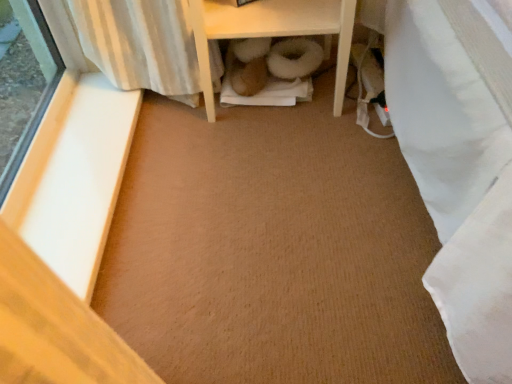
At what (x,y) coordinates should I click in order to perform the action: click on white wood shelf at center. Please return your answer as a coordinate pair (x, y). Looking at the image, I should click on [x=272, y=31].

Describe the element at coordinates (272, 31) in the screenshot. The width and height of the screenshot is (512, 384). I see `white wood shelf at center` at that location.

Measure the distance between point [24,178] and camera.

The depth of point [24,178] is 3.36 feet.

The width and height of the screenshot is (512, 384). What do you see at coordinates (74, 177) in the screenshot? I see `white smooth wood at left` at bounding box center [74, 177].

Measure the distance between white smooth wood at left and camera.

white smooth wood at left and camera are 32.50 inches apart.

The width and height of the screenshot is (512, 384). Find the location of `white smooth wood at left`. white smooth wood at left is located at coordinates 74,177.

Where is `white wood shelf at center`? white wood shelf at center is located at coordinates (272, 31).

Considering the relative positions of white wood shelf at center and white smooth wood at left in the image provided, is white wood shelf at center to the right of white smooth wood at left from the viewer's perspective?

Indeed, white wood shelf at center is positioned on the right side of white smooth wood at left.

Is the depth of white wood shelf at center greater than that of white smooth wood at left?

Yes.

Does point (208, 82) appear closer or farther from the camera than point (93, 162)?

Point (208, 82) is farther from the camera than point (93, 162).

Looking at this image, from the image's perspective, does white wood shelf at center appear higher than white smooth wood at left?

Yes, from the image's perspective, white wood shelf at center is over white smooth wood at left.

From a real-world perspective, does white wood shelf at center stand above white smooth wood at left?

Correct, in the physical world, white wood shelf at center is higher than white smooth wood at left.

Based on the photo, considering the relative sizes of white wood shelf at center and white smooth wood at left in the image provided, is white wood shelf at center thinner than white smooth wood at left?

No.

Who is shorter, white wood shelf at center or white smooth wood at left?

With less height is white smooth wood at left.

Does white wood shelf at center have a larger size compared to white smooth wood at left?

Yes.

Looking at this image, is white wood shelf at center situated inside white smooth wood at left or outside?

white wood shelf at center cannot be found inside white smooth wood at left.

Is white wood shelf at center touching white smooth wood at left?

They are not placed beside each other.

Is white wood shelf at center aimed at white smooth wood at left?

No, white wood shelf at center is not facing towards white smooth wood at left.

Locate an element on the screen. This screenshot has height=384, width=512. furniture above the white smooth wood at left (from a real-world perspective) is located at coordinates click(x=272, y=31).

Does white smooth wood at left appear on the left side of white wood shelf at center?

Correct, you'll find white smooth wood at left to the left of white wood shelf at center.

Is white smooth wood at left in front of or behind white wood shelf at center in the image?

Clearly, white smooth wood at left is in front of white wood shelf at center.

Which is closer to the camera, (42, 248) or (207, 6)?

The point (42, 248) is more forward.

From the image's perspective, is white smooth wood at left on top of white wood shelf at center?

No, from the image's perspective, white smooth wood at left is not above white wood shelf at center.

From a real-world perspective, is white smooth wood at left beneath white wood shelf at center?

Yes.

Does white smooth wood at left have a greater width compared to white wood shelf at center?

No.

Which of these two, white smooth wood at left or white wood shelf at center, stands taller?

white wood shelf at center is taller.

Who is bigger, white smooth wood at left or white wood shelf at center?

With larger size is white wood shelf at center.

Is white smooth wood at left inside or outside of white wood shelf at center?

white smooth wood at left is spatially situated outside white wood shelf at center.

Are white smooth wood at left and white wood shelf at center far apart?

No, white smooth wood at left is in close proximity to white wood shelf at center.

Could you tell me if white smooth wood at left is turned towards white wood shelf at center?

No.

This screenshot has width=512, height=384. I want to click on furniture that is above the white smooth wood at left (from a real-world perspective), so click(x=272, y=31).

In order to click on furniture above the white smooth wood at left (from a real-world perspective) in this screenshot , I will do `click(272, 31)`.

Where is `furniture that appears on the right of white smooth wood at left`? This screenshot has height=384, width=512. furniture that appears on the right of white smooth wood at left is located at coordinates (272, 31).